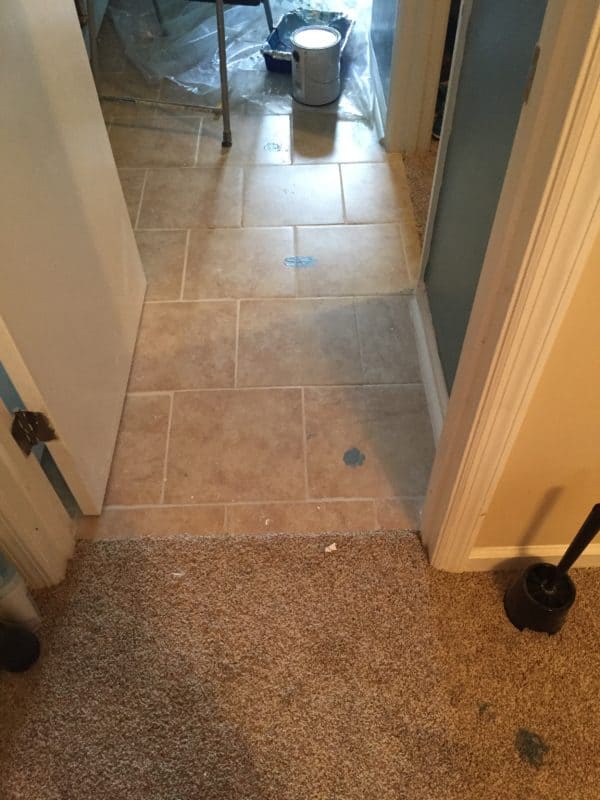
Where is `white paint`? The width and height of the screenshot is (600, 800). white paint is located at coordinates (320, 34).